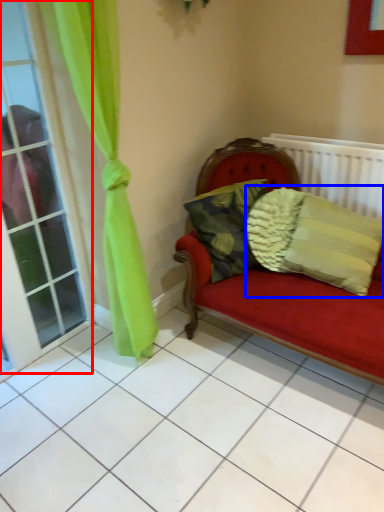
Question: Among these objects, which one is farthest to the camera, window (highlighted by a red box) or pillow (highlighted by a blue box)?

Choices:
 (A) window
 (B) pillow

Answer: (B)